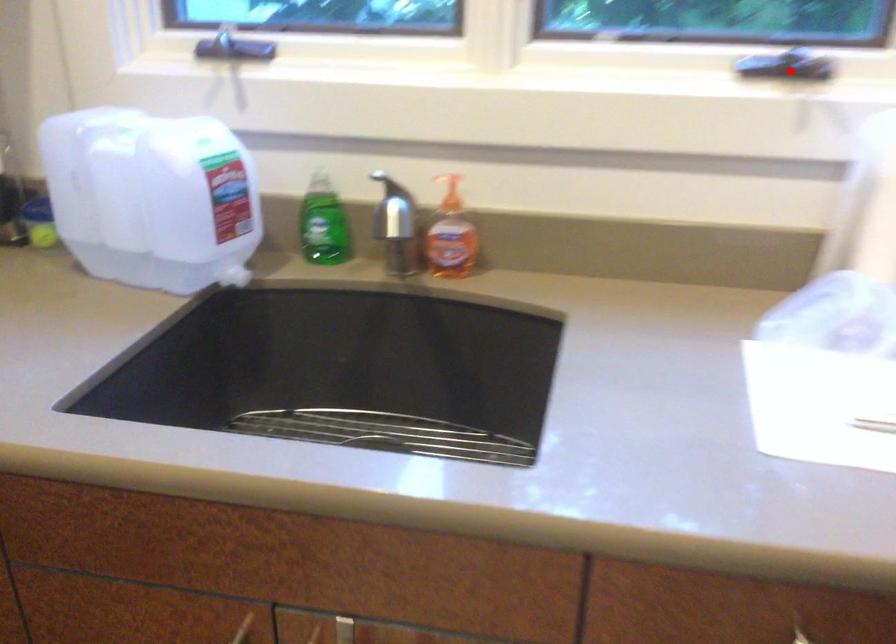
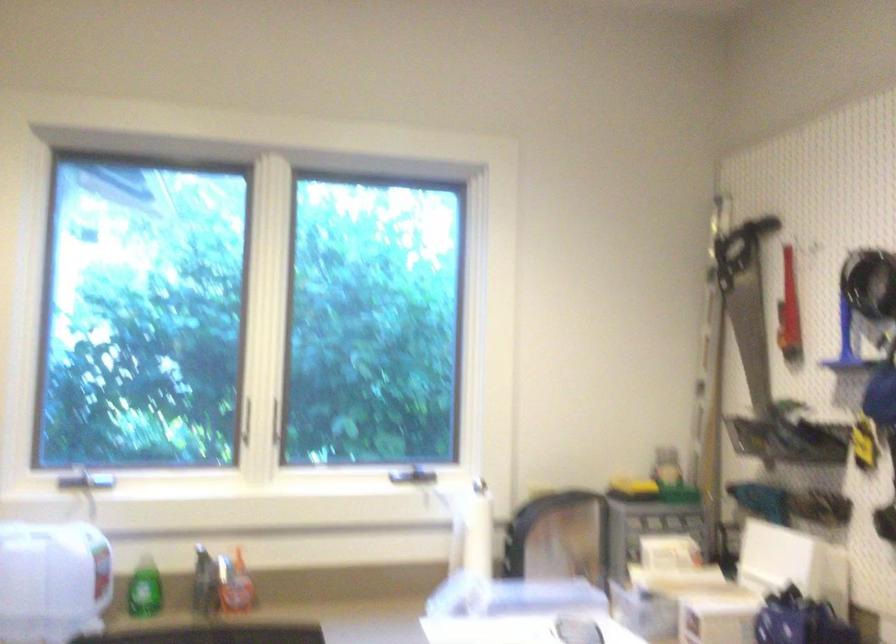
Question: I am providing you with two images of the same scene from different viewpoints. A red point is shown in image1. For the corresponding object point in image2, is it positioned nearer or farther from the camera?

Choices:
 (A) Nearer
 (B) Farther

Answer: (B)